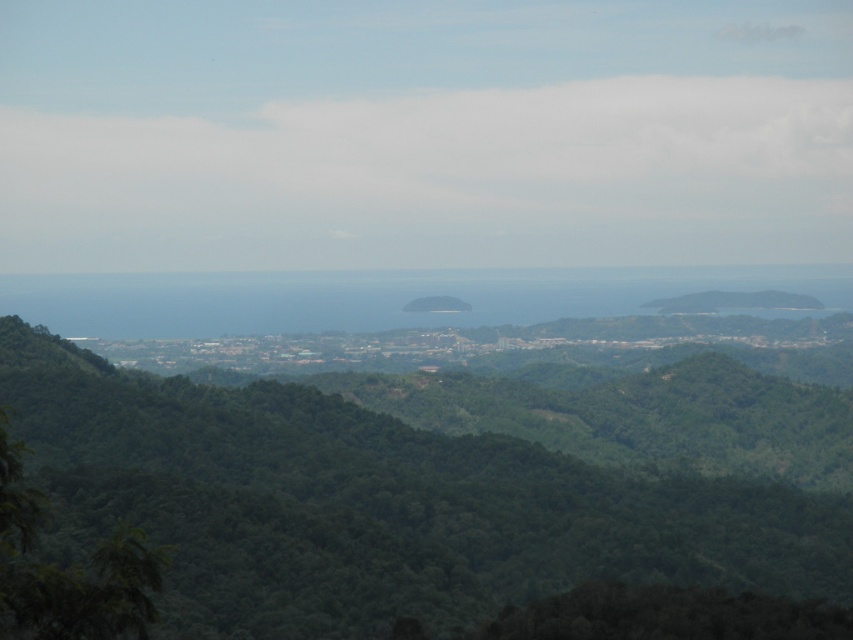
You are a hiker standing in the middle of the forest. You notice green leafy trees at center and green leafy tree at lower left. Which one would block more sunlight if you want to find a spot to set up your tent?

The green leafy trees at center is bigger than the green leafy tree at lower left, so it would block more sunlight and is better for setting up your tent if you want shade.

You are an environmental scientist studying tree growth patterns in this landscape. You observe the green leafy trees at center and the green leafy tree at lower left. Which of these has a greater width according to your measurements?

The green leafy trees at center has a greater width than the green leafy tree at lower left.

You are navigating a drone through the landscape shown in the image. Your route requires you to pass between two points, point (210, 480) and point (53, 632). Which point should you approach first to ensure you follow the correct path?

You should approach point (53, 632) first because point (210, 480) is behind it, so approaching the closer point first ensures you follow the correct path.